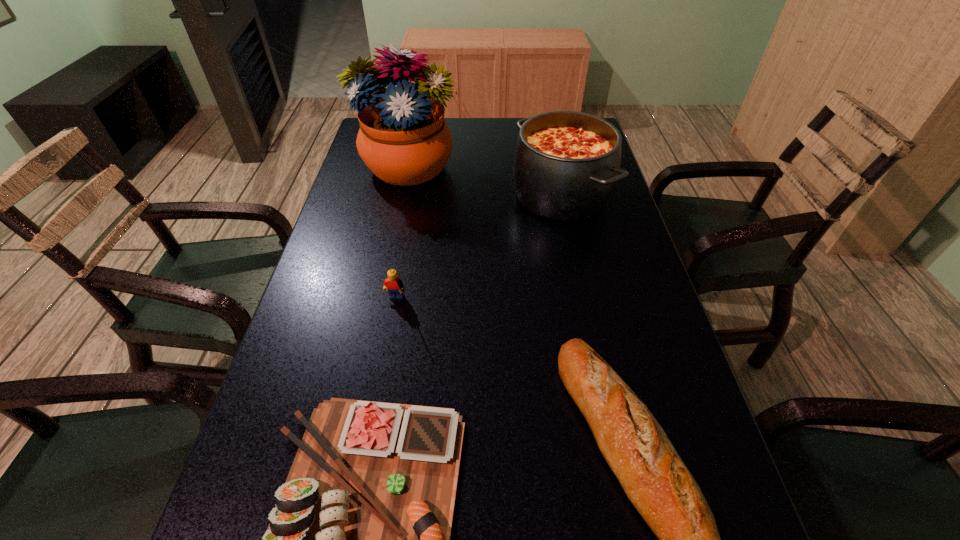
At what (x,y) coordinates should I click in order to perform the action: click on object present at the far left corner. Please return your answer as a coordinate pair (x, y). This screenshot has width=960, height=540. Looking at the image, I should click on (403, 138).

Find the location of `vacant space at the far edge`. vacant space at the far edge is located at coordinates (496, 146).

The width and height of the screenshot is (960, 540). In the image, there is a desktop. Find the location of `vacant space at the left edge`. vacant space at the left edge is located at coordinates (302, 353).

In the image, there is a desktop. Identify the location of vacant space at the right edge. (728, 526).

The width and height of the screenshot is (960, 540). I want to click on unoccupied area between the flower arrangement and the fourth shortest object, so [x=483, y=182].

Identify the location of free space between the third farthest object and the casserole. The height and width of the screenshot is (540, 960). (478, 250).

The width and height of the screenshot is (960, 540). Identify the location of free space between the tallest object and the casserole. (483, 182).

Identify the location of object that is the closest to the Lego. This screenshot has width=960, height=540. (359, 539).

The width and height of the screenshot is (960, 540). I want to click on object that can be found as the fourth closest to the second tallest object, so click(359, 539).